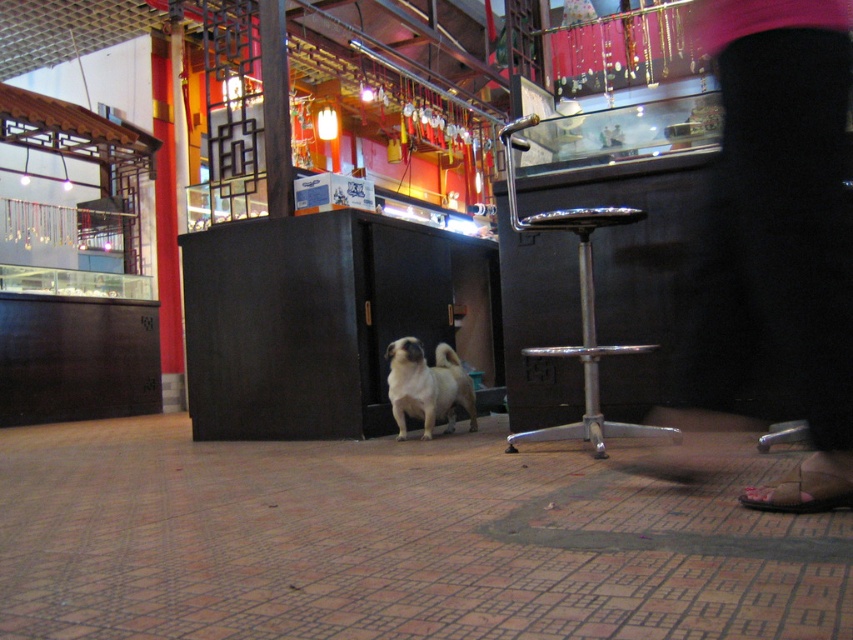
Question: Considering the real-world distances, which object is closest to the light brown fur at center?

Choices:
 (A) polished chrome bar stool at center
 (B) black fabric pants at lower right

Answer: (A)

Question: Estimate the real-world distances between objects in this image. Which object is farther from the black fabric pants at lower right?

Choices:
 (A) light brown fur at center
 (B) polished chrome bar stool at center

Answer: (A)

Question: Can you confirm if black fabric pants at lower right is positioned below polished chrome bar stool at center?

Choices:
 (A) yes
 (B) no

Answer: (B)

Question: Does polished chrome bar stool at center lie behind light brown fur at center?

Choices:
 (A) no
 (B) yes

Answer: (A)

Question: Which object appears farthest from the camera in this image?

Choices:
 (A) light brown fur at center
 (B) black fabric pants at lower right

Answer: (A)

Question: Is black fabric pants at lower right bigger than polished chrome bar stool at center?

Choices:
 (A) no
 (B) yes

Answer: (A)